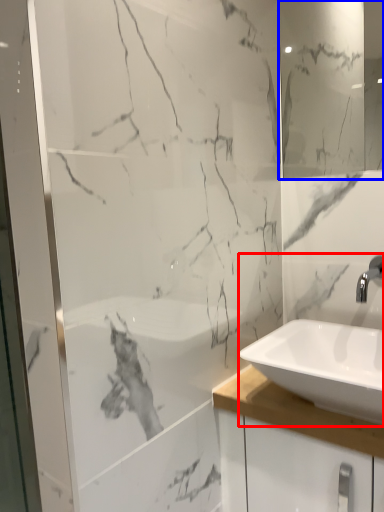
Question: Which object is closer to the camera taking this photo, sink (highlighted by a red box) or mirror (highlighted by a blue box)?

Choices:
 (A) sink
 (B) mirror

Answer: (A)